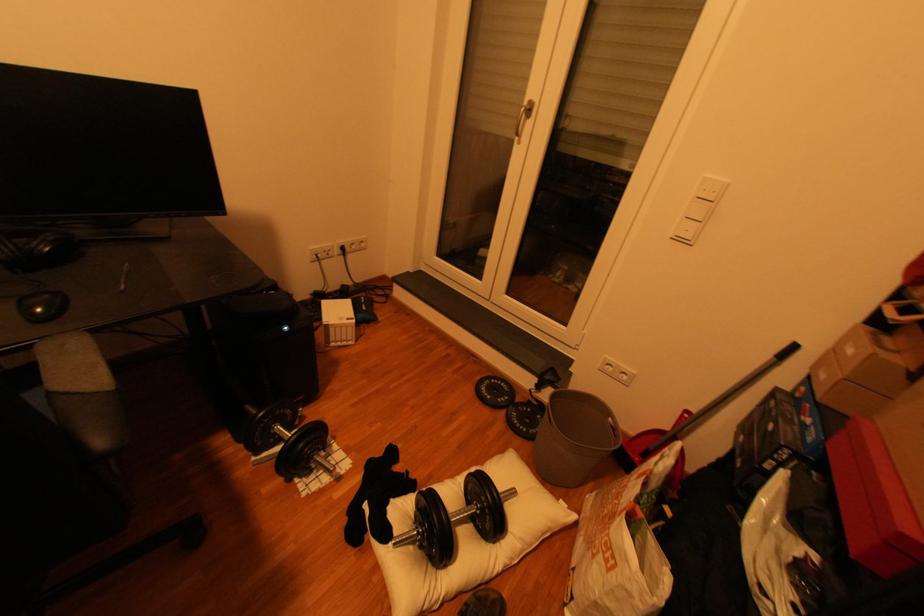
Describe the element at coordinates (699, 209) in the screenshot. I see `the white light switch` at that location.